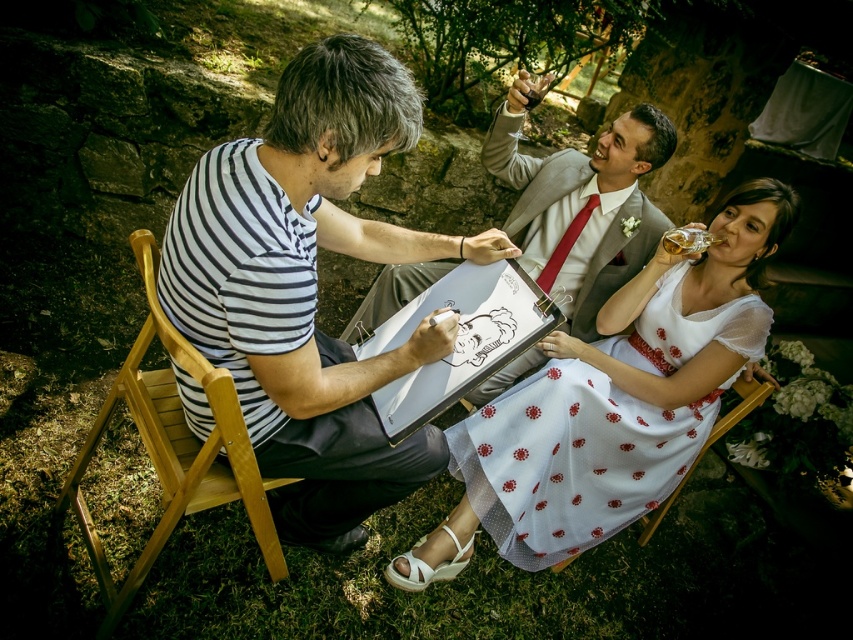
You are a photographer at the wedding reception and need to capture a closeup shot of the striped cotton shirt at center without including the wooden chair at lower center in the frame. Is this possible given their sizes?

The striped cotton shirt at center is wider than the wooden chair at lower center, so it is possible to frame the shot to focus solely on the striped cotton shirt at center while excluding the wooden chair at lower center.

Looking at this image, you are standing in the rustic garden courtyard and want to place a small decorative item exactly at the point marked as point (310,288). Which object from the scene will this point be located on?

The point (310,288) is located on the striped cotton shirt at center.

You are a photographer at the wedding reception. You need to capture a photo of the matte gray suit at center and the wooden chair at lower center. Which object is positioned higher in the image?

The matte gray suit at center is above the wooden chair at lower center, so it is positioned higher in the image.